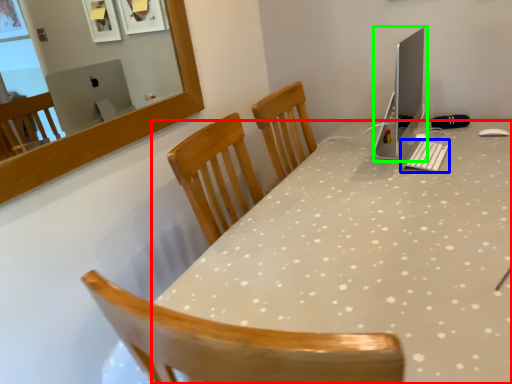
Question: Which object is positioned farthest from desk (highlighted by a red box)? Select from keyboard (highlighted by a blue box) and computer monitor (highlighted by a green box).

Choices:
 (A) keyboard
 (B) computer monitor

Answer: (B)